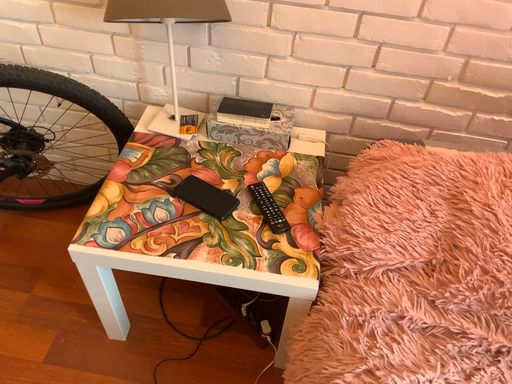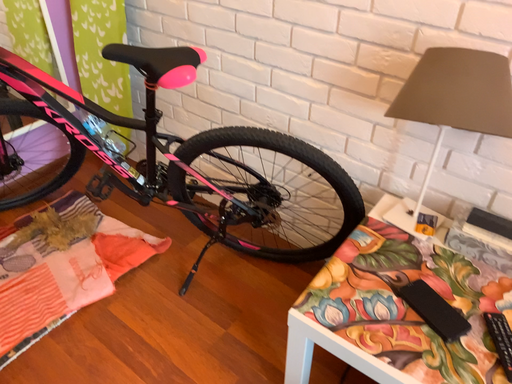
Question: Which way did the camera rotate in the video?

Choices:
 (A) rotated upward
 (B) rotated downward

Answer: (A)